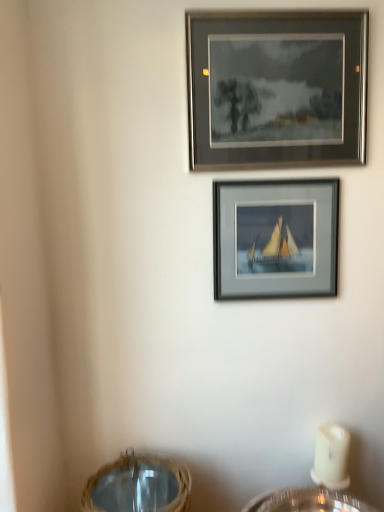
Question: Should I look upward or downward to see matte gray frame at upper center, which is the 2th picture frame in bottom-to-top order?

Choices:
 (A) down
 (B) up

Answer: (B)

Question: Is the surface of matte gray frame at upper center, marked as the 1th picture frame in a top-to-bottom arrangement, in direct contact with matte gray frame at center, the first picture frame when ordered from bottom to top?

Choices:
 (A) yes
 (B) no

Answer: (B)

Question: Is matte gray frame at upper center, which is the 2th picture frame in bottom-to-top order, shorter than matte gray frame at center, the first picture frame when ordered from bottom to top?

Choices:
 (A) yes
 (B) no

Answer: (B)

Question: Is matte gray frame at upper center, marked as the 1th picture frame in a top-to-bottom arrangement, in front of matte gray frame at center, the second picture frame when ordered from top to bottom?

Choices:
 (A) no
 (B) yes

Answer: (B)

Question: From the image's perspective, is matte gray frame at upper center, which is the 2th picture frame in bottom-to-top order, beneath matte gray frame at center, the second picture frame when ordered from top to bottom?

Choices:
 (A) yes
 (B) no

Answer: (B)

Question: From the image's perspective, does matte gray frame at upper center, marked as the 1th picture frame in a top-to-bottom arrangement, appear higher than matte gray frame at center, the first picture frame when ordered from bottom to top?

Choices:
 (A) yes
 (B) no

Answer: (A)

Question: Does matte gray frame at upper center, which is the 2th picture frame in bottom-to-top order, come behind matte gray frame at center, the second picture frame when ordered from top to bottom?

Choices:
 (A) no
 (B) yes

Answer: (A)

Question: Does woven straw basket at lower center touch matte gray frame at upper center, which is the 2th picture frame in bottom-to-top order?

Choices:
 (A) no
 (B) yes

Answer: (A)

Question: Are woven straw basket at lower center and matte gray frame at upper center, marked as the 1th picture frame in a top-to-bottom arrangement, far apart?

Choices:
 (A) no
 (B) yes

Answer: (B)

Question: From the image's perspective, is woven straw basket at lower center below matte gray frame at upper center, which is the 2th picture frame in bottom-to-top order?

Choices:
 (A) yes
 (B) no

Answer: (A)

Question: Considering the relative positions of woven straw basket at lower center and matte gray frame at upper center, marked as the 1th picture frame in a top-to-bottom arrangement, in the image provided, is woven straw basket at lower center behind matte gray frame at upper center, marked as the 1th picture frame in a top-to-bottom arrangement,?

Choices:
 (A) no
 (B) yes

Answer: (A)

Question: Does woven straw basket at lower center have a lesser width compared to matte gray frame at upper center, which is the 2th picture frame in bottom-to-top order?

Choices:
 (A) yes
 (B) no

Answer: (B)

Question: Is woven straw basket at lower center not inside matte gray frame at upper center, marked as the 1th picture frame in a top-to-bottom arrangement?

Choices:
 (A) yes
 (B) no

Answer: (A)

Question: Is matte gray frame at center, the second picture frame when ordered from top to bottom, aimed at woven straw basket at lower center?

Choices:
 (A) yes
 (B) no

Answer: (B)